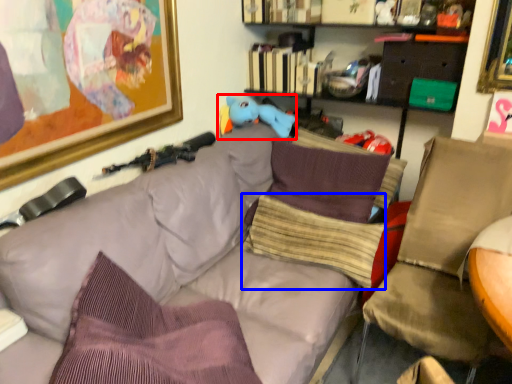
Question: Which object appears closest to the camera in this image, toy (highlighted by a red box) or pillow (highlighted by a blue box)?

Choices:
 (A) toy
 (B) pillow

Answer: (B)